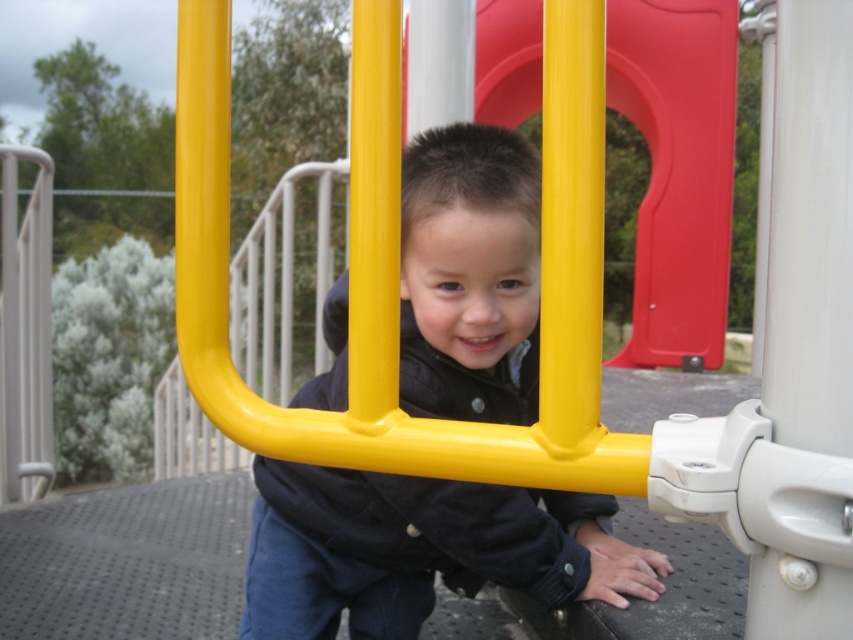
Who is higher up, matte black jacket at center or smooth plastic slide at center?

Positioned higher is smooth plastic slide at center.

Describe the element at coordinates (421, 548) in the screenshot. I see `matte black jacket at center` at that location.

Does point (460, 161) lie in front of point (618, 19)?

Yes, point (460, 161) is closer to viewer.

You are a GUI agent. You are given a task and a screenshot of the screen. Output one action in this format:
    pyautogui.click(x=<x>, y=<y>)
    Task: Click on the matte black jacket at center
    
    Given the screenshot: What is the action you would take?
    pyautogui.click(x=421, y=548)

Does smooth plastic slide at center have a greater height compared to yellow matte pole at center?

Correct, smooth plastic slide at center is much taller as yellow matte pole at center.

Who is more distant from viewer, (721, 83) or (196, 234)?

Positioned behind is point (721, 83).

Locate an element on the screen. smooth plastic slide at center is located at coordinates (677, 170).

Find the location of a particular element. smooth plastic slide at center is located at coordinates (677, 170).

Between point (465, 563) and point (199, 280), which one is positioned behind?

The point (465, 563) is behind.

Is point (509, 502) positioned behind point (212, 371)?

Yes, point (509, 502) is behind point (212, 371).

Which is in front, point (434, 198) or point (225, 108)?

Positioned in front is point (225, 108).

At what (x,y) coordinates should I click in order to perform the action: click on matte black jacket at center. Please return your answer as a coordinate pair (x, y). The width and height of the screenshot is (853, 640). Looking at the image, I should click on (421, 548).